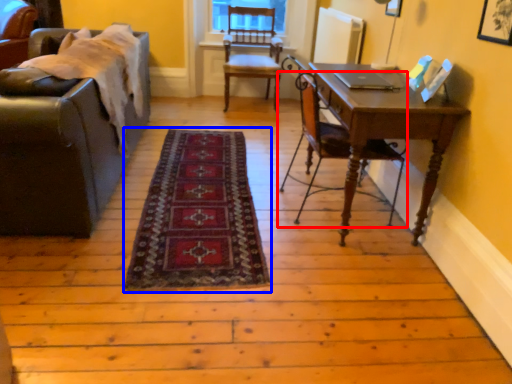
Question: Which point is closer to the camera, chair (highlighted by a red box) or mat (highlighted by a blue box)?

Choices:
 (A) chair
 (B) mat

Answer: (B)